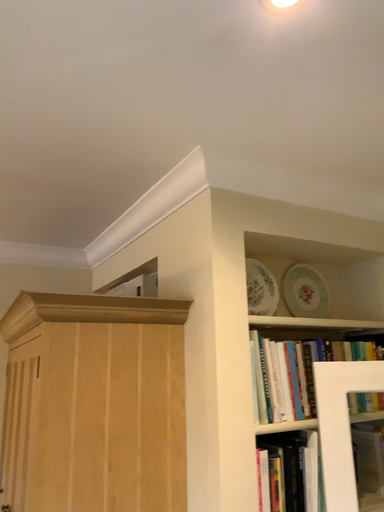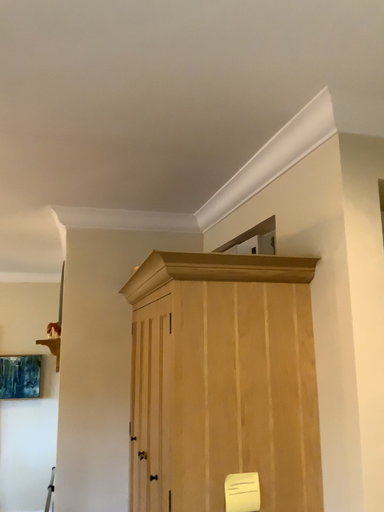
Question: How did the camera likely rotate when shooting the video?

Choices:
 (A) rotated right
 (B) rotated left

Answer: (B)